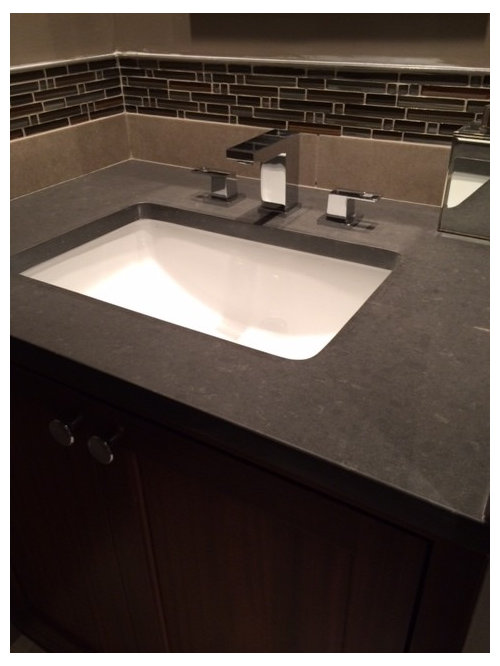
Find the location of a particular element. Image resolution: width=500 pixels, height=666 pixels. white sink is located at coordinates (222, 310).